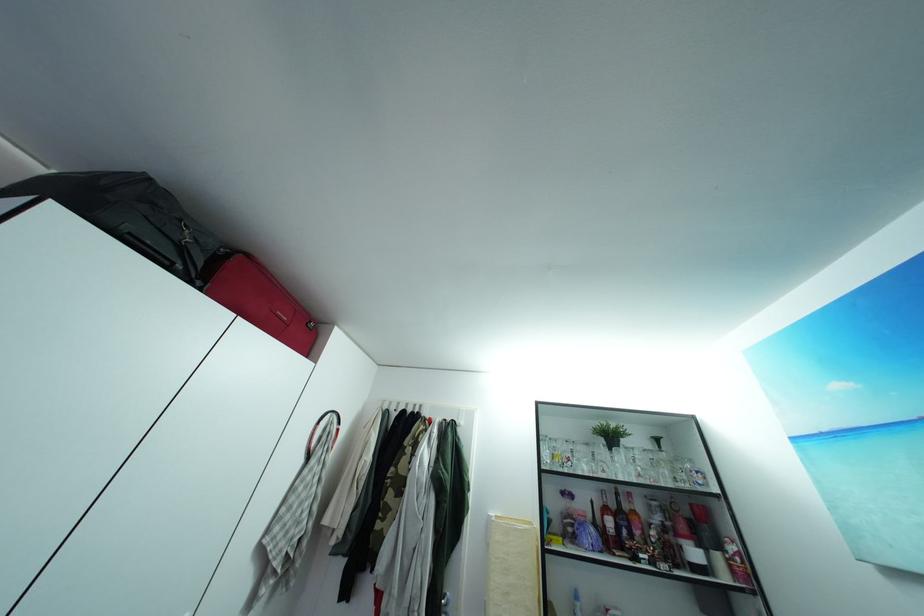
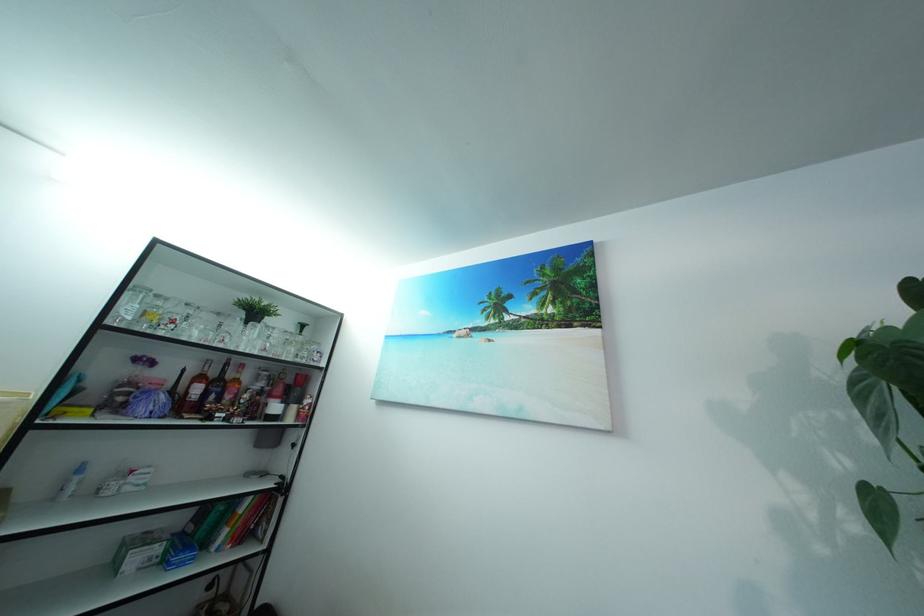
Find the pixel in the second image that matches (x=621, y=513) in the first image.

(222, 381)